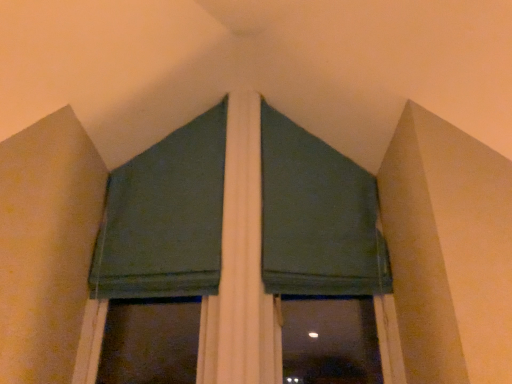
What do you see at coordinates (317, 217) in the screenshot? I see `dark green fabric at upper center, placed as the first curtain when sorted from right to left` at bounding box center [317, 217].

In order to face dark green fabric at upper center, marked as the first curtain in a left-to-right arrangement, should I rotate leftwards or rightwards?

To align with it, rotate left about 11.795°.

Find the location of a particular element. dark green fabric at center is located at coordinates (240, 231).

Is dark green fabric at upper center, marked as the first curtain in a left-to-right arrangement, facing towards dark green fabric at upper center, the 2th curtain in the left-to-right sequence?

No, dark green fabric at upper center, marked as the first curtain in a left-to-right arrangement, is not aimed at dark green fabric at upper center, the 2th curtain in the left-to-right sequence.

Can you confirm if dark green fabric at upper center, the second curtain from the right, is wider than dark green fabric at upper center, placed as the first curtain when sorted from right to left?

Incorrect, the width of dark green fabric at upper center, the second curtain from the right, does not surpass that of dark green fabric at upper center, placed as the first curtain when sorted from right to left.

Is dark green fabric at upper center, the second curtain from the right, outside of dark green fabric at upper center, the 2th curtain in the left-to-right sequence?

Absolutely, dark green fabric at upper center, the second curtain from the right, is external to dark green fabric at upper center, the 2th curtain in the left-to-right sequence.

Considering the relative positions of dark green fabric at center and dark green fabric at upper center, the second curtain from the right, in the image provided, is dark green fabric at center to the left of dark green fabric at upper center, the second curtain from the right, from the viewer's perspective?

No.

From the image's perspective, which one is positioned higher, dark green fabric at center or dark green fabric at upper center, the second curtain from the right?

dark green fabric at upper center, the second curtain from the right, is shown above in the image.

Which of these two, dark green fabric at center or dark green fabric at upper center, the second curtain from the right, is smaller?

dark green fabric at upper center, the second curtain from the right, is smaller.

Looking at their sizes, would you say dark green fabric at center is wider or thinner than dark green fabric at upper center, marked as the first curtain in a left-to-right arrangement?

Considering their sizes, dark green fabric at center looks broader than dark green fabric at upper center, marked as the first curtain in a left-to-right arrangement.

Which of these two, dark green fabric at upper center, placed as the first curtain when sorted from right to left, or dark green fabric at center, stands shorter?

With less height is dark green fabric at upper center, placed as the first curtain when sorted from right to left.

Which point is more forward, (321, 170) or (221, 142)?

The point (321, 170) is more forward.

Could you tell me if dark green fabric at upper center, the 2th curtain in the left-to-right sequence, is turned towards dark green fabric at center?

Yes, dark green fabric at upper center, the 2th curtain in the left-to-right sequence, is oriented towards dark green fabric at center.

Is dark green fabric at center wider than dark green fabric at upper center, placed as the first curtain when sorted from right to left?

Indeed, dark green fabric at center has a greater width compared to dark green fabric at upper center, placed as the first curtain when sorted from right to left.

Are dark green fabric at center and dark green fabric at upper center, the 2th curtain in the left-to-right sequence, beside each other?

No.

Does dark green fabric at center appear on the right side of dark green fabric at upper center, placed as the first curtain when sorted from right to left?

Incorrect, dark green fabric at center is not on the right side of dark green fabric at upper center, placed as the first curtain when sorted from right to left.

Which of these two, dark green fabric at center or dark green fabric at upper center, placed as the first curtain when sorted from right to left, stands shorter?

dark green fabric at upper center, placed as the first curtain when sorted from right to left.

Is dark green fabric at upper center, the 2th curtain in the left-to-right sequence, inside or outside of dark green fabric at upper center, marked as the first curtain in a left-to-right arrangement?

dark green fabric at upper center, the 2th curtain in the left-to-right sequence, is outside dark green fabric at upper center, marked as the first curtain in a left-to-right arrangement.

Does point (270, 108) come in front of point (200, 295)?

That is False.

Considering the relative sizes of dark green fabric at upper center, the 2th curtain in the left-to-right sequence, and dark green fabric at upper center, marked as the first curtain in a left-to-right arrangement, in the image provided, is dark green fabric at upper center, the 2th curtain in the left-to-right sequence, bigger than dark green fabric at upper center, marked as the first curtain in a left-to-right arrangement,?

Yes.

From the image's perspective, is dark green fabric at upper center, placed as the first curtain when sorted from right to left, above or below dark green fabric at upper center, marked as the first curtain in a left-to-right arrangement?

dark green fabric at upper center, placed as the first curtain when sorted from right to left, is situated lower than dark green fabric at upper center, marked as the first curtain in a left-to-right arrangement, in the image.

Between dark green fabric at upper center, marked as the first curtain in a left-to-right arrangement, and dark green fabric at center, which one has larger width?

dark green fabric at center.

From the image's perspective, is dark green fabric at upper center, marked as the first curtain in a left-to-right arrangement, located beneath dark green fabric at center?

No, from the image's perspective, dark green fabric at upper center, marked as the first curtain in a left-to-right arrangement, is not below dark green fabric at center.

In the scene shown: Is dark green fabric at upper center, the second curtain from the right, shorter than dark green fabric at center?

Indeed, dark green fabric at upper center, the second curtain from the right, has a lesser height compared to dark green fabric at center.

Is dark green fabric at upper center, marked as the first curtain in a left-to-right arrangement, positioned beyond the bounds of dark green fabric at center?

Actually, dark green fabric at upper center, marked as the first curtain in a left-to-right arrangement, is at least partially inside dark green fabric at center.

This screenshot has width=512, height=384. Find the location of `curtain lying on the left of dark green fabric at upper center, placed as the first curtain when sorted from right to left`. curtain lying on the left of dark green fabric at upper center, placed as the first curtain when sorted from right to left is located at coordinates (165, 217).

Locate an element on the screen. The width and height of the screenshot is (512, 384). bay window that appears below the dark green fabric at upper center, the second curtain from the right (from a real-world perspective) is located at coordinates (240, 231).

Looking at the image, which one is located further to dark green fabric at upper center, marked as the first curtain in a left-to-right arrangement, dark green fabric at upper center, placed as the first curtain when sorted from right to left, or dark green fabric at center?

Among the two, dark green fabric at upper center, placed as the first curtain when sorted from right to left, is located further to dark green fabric at upper center, marked as the first curtain in a left-to-right arrangement.

From the image, which object appears to be farther from dark green fabric at center, dark green fabric at upper center, marked as the first curtain in a left-to-right arrangement, or dark green fabric at upper center, the 2th curtain in the left-to-right sequence?

dark green fabric at upper center, marked as the first curtain in a left-to-right arrangement, is further to dark green fabric at center.

Considering their positions, is dark green fabric at upper center, the 2th curtain in the left-to-right sequence, positioned further to dark green fabric at center than dark green fabric at upper center, marked as the first curtain in a left-to-right arrangement?

Among the two, dark green fabric at upper center, marked as the first curtain in a left-to-right arrangement, is located further to dark green fabric at center.

Which object lies nearer to the anchor point dark green fabric at upper center, marked as the first curtain in a left-to-right arrangement, dark green fabric at center or dark green fabric at upper center, the 2th curtain in the left-to-right sequence?

dark green fabric at center is closer to dark green fabric at upper center, marked as the first curtain in a left-to-right arrangement.

Based on their spatial positions, is dark green fabric at center or dark green fabric at upper center, marked as the first curtain in a left-to-right arrangement, closer to dark green fabric at upper center, the 2th curtain in the left-to-right sequence?

dark green fabric at center.

Based on their spatial positions, is dark green fabric at upper center, marked as the first curtain in a left-to-right arrangement, or dark green fabric at center further from dark green fabric at upper center, placed as the first curtain when sorted from right to left?

dark green fabric at upper center, marked as the first curtain in a left-to-right arrangement, lies further to dark green fabric at upper center, placed as the first curtain when sorted from right to left, than the other object.

This screenshot has width=512, height=384. Find the location of `bay window between dark green fabric at upper center, marked as the first curtain in a left-to-right arrangement, and dark green fabric at upper center, placed as the first curtain when sorted from right to left, in the horizontal direction`. bay window between dark green fabric at upper center, marked as the first curtain in a left-to-right arrangement, and dark green fabric at upper center, placed as the first curtain when sorted from right to left, in the horizontal direction is located at coordinates (240, 231).